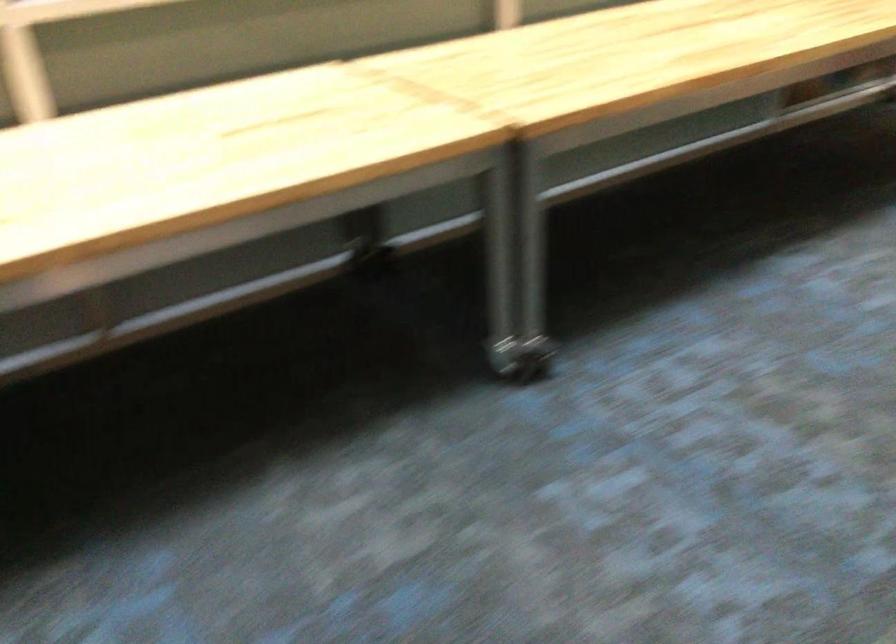
How did the camera likely rotate?

The rotation direction of the camera is right-down.